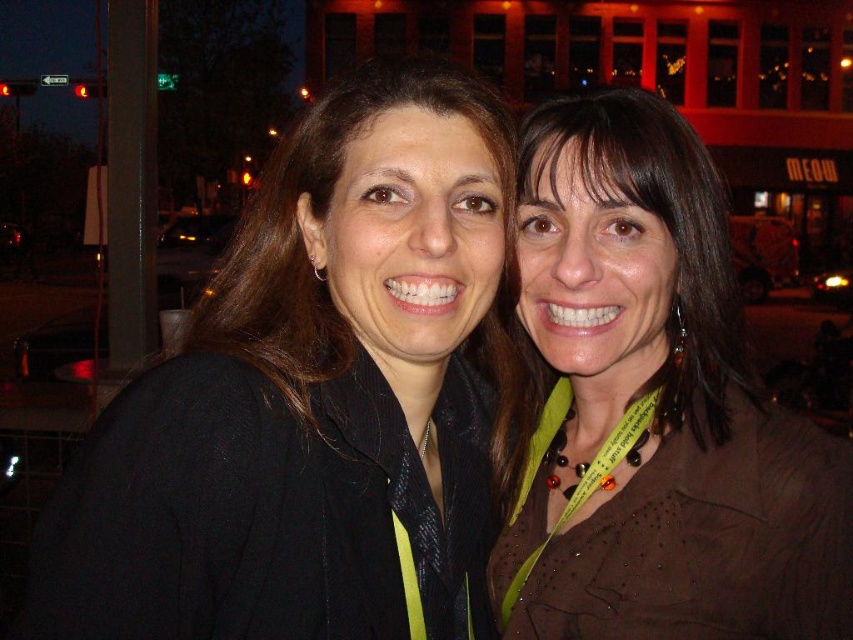
Question: Among these objects, which one is farthest from the camera?

Choices:
 (A) brown matte shirt at center
 (B) brown matte hair at right

Answer: (B)

Question: Is brown matte shirt at center further to the viewer compared to brown matte hair at right?

Choices:
 (A) no
 (B) yes

Answer: (A)

Question: Does brown matte shirt at center have a smaller size compared to brown matte hair at right?

Choices:
 (A) yes
 (B) no

Answer: (B)

Question: Is brown matte shirt at center in front of brown matte hair at right?

Choices:
 (A) no
 (B) yes

Answer: (B)

Question: Which point appears farthest from the camera in this image?

Choices:
 (A) (561, 125)
 (B) (556, 195)

Answer: (A)